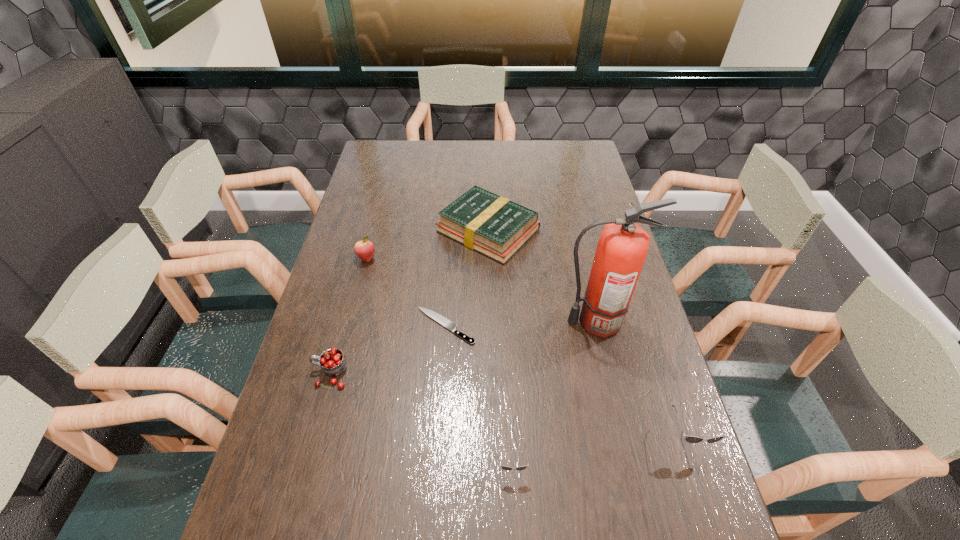
Where is `vacant space in between the fire extinguisher and the right sunglasses`? The image size is (960, 540). vacant space in between the fire extinguisher and the right sunglasses is located at coordinates (641, 379).

You are a GUI agent. You are given a task and a screenshot of the screen. Output one action in this format:
    pyautogui.click(x=<x>, y=<y>)
    Task: Click on the empty space that is in between the fire extinguisher and the apple
    This screenshot has height=540, width=960.
    Given the screenshot: What is the action you would take?
    pyautogui.click(x=481, y=291)

Identify the location of vacant space in between the hardback book and the shortest object. Image resolution: width=960 pixels, height=540 pixels. pos(467,278).

At what (x,y) coordinates should I click in order to perform the action: click on vacant space in between the hardback book and the cherry. Please return your answer as a coordinate pair (x, y). This screenshot has height=540, width=960. Looking at the image, I should click on (409, 302).

You are a GUI agent. You are given a task and a screenshot of the screen. Output one action in this format:
    pyautogui.click(x=<x>, y=<y>)
    Task: Click on the vacant area that lies between the fire extinguisher and the right sunglasses
    
    Given the screenshot: What is the action you would take?
    pyautogui.click(x=641, y=379)

The width and height of the screenshot is (960, 540). In order to click on empty space that is in between the fifth farthest object and the apple in this screenshot , I will do `click(348, 316)`.

Identify the location of free space between the shorter sunglasses and the third nearest object. point(421,419).

At what (x,y) coordinates should I click in order to perform the action: click on the fourth closest object to the second shortest object. Please return your answer as a coordinate pair (x, y). The height and width of the screenshot is (540, 960). Looking at the image, I should click on (332, 361).

Point out which object is positioned as the fifth nearest to the third shortest object. Please provide its 2D coordinates. Your answer should be formatted as a tuple, i.e. [(x, y)], where the tuple contains the x and y coordinates of a point satisfying the conditions above.

[(691, 439)]

Identify the location of blank space that satisfies the following two spatial constraints: 1. on the handle side of the cherry; 2. on the back side of the third shortest object. (370, 230).